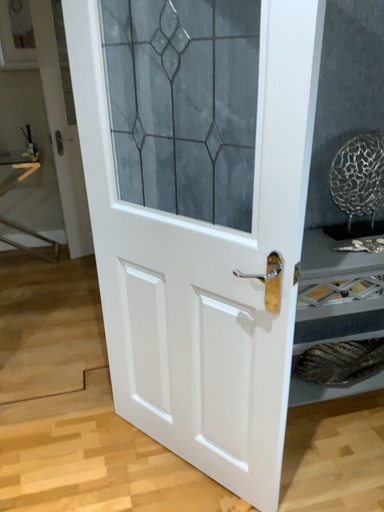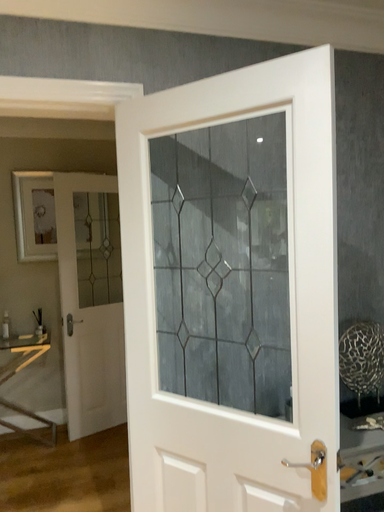
Question: Which way did the camera rotate in the video?

Choices:
 (A) rotated upward
 (B) rotated downward

Answer: (A)